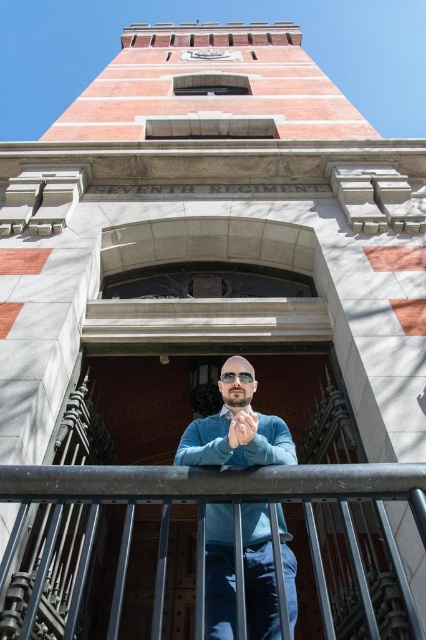
You are a photographer trying to capture a portrait of the man on the balcony. The metallic steel balustrade at lower center and the blue sweater at center are both in the frame. Which object appears taller in the photograph?

The metallic steel balustrade at lower center appears taller than the blue sweater at center in the photograph.

You are a photographer taking a picture of the SEVENTH REGIMENT building. You notice the metallic steel balustrade at lower center and the clear plastic goggles at center. Which object is closer to the camera?

The clear plastic goggles at center are closer to the camera because the metallic steel balustrade at lower center is positioned under them.